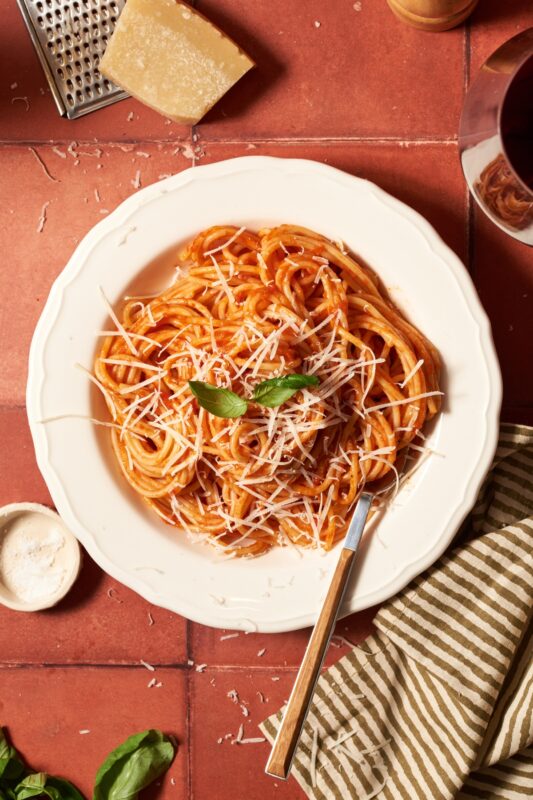
Where is `utensil`? Image resolution: width=533 pixels, height=800 pixels. utensil is located at coordinates (358, 510).